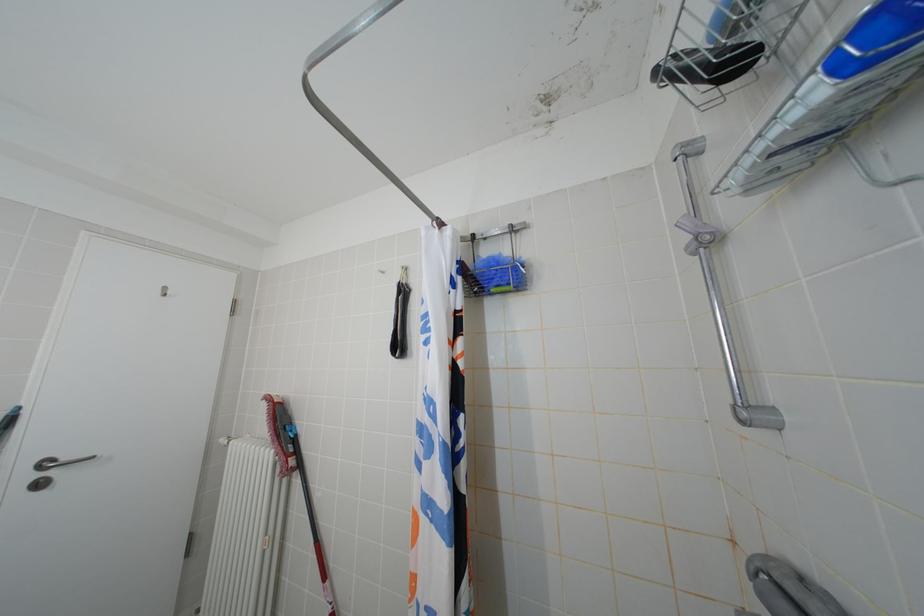
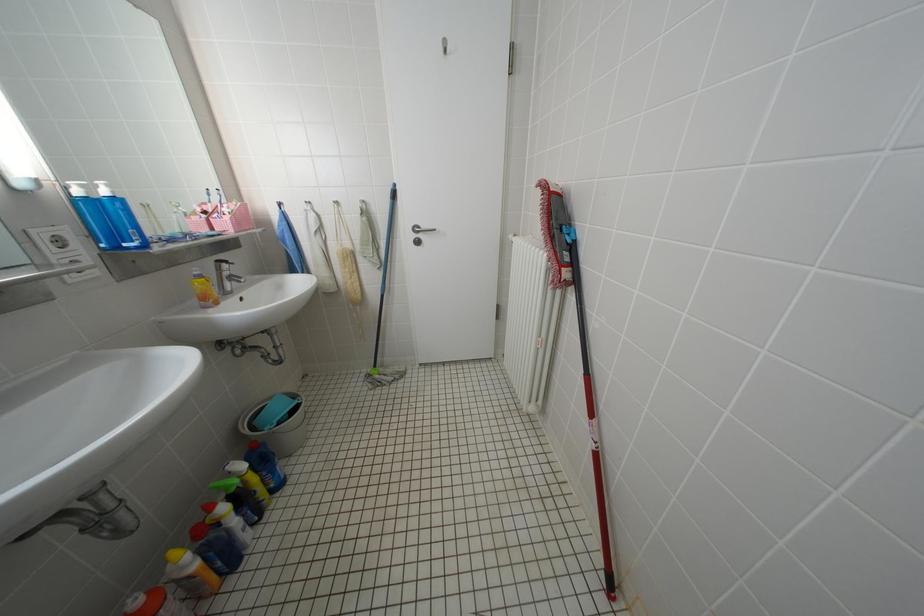
First-person continuous shooting, in which direction is the camera rotating?

The camera rotated toward left-down.